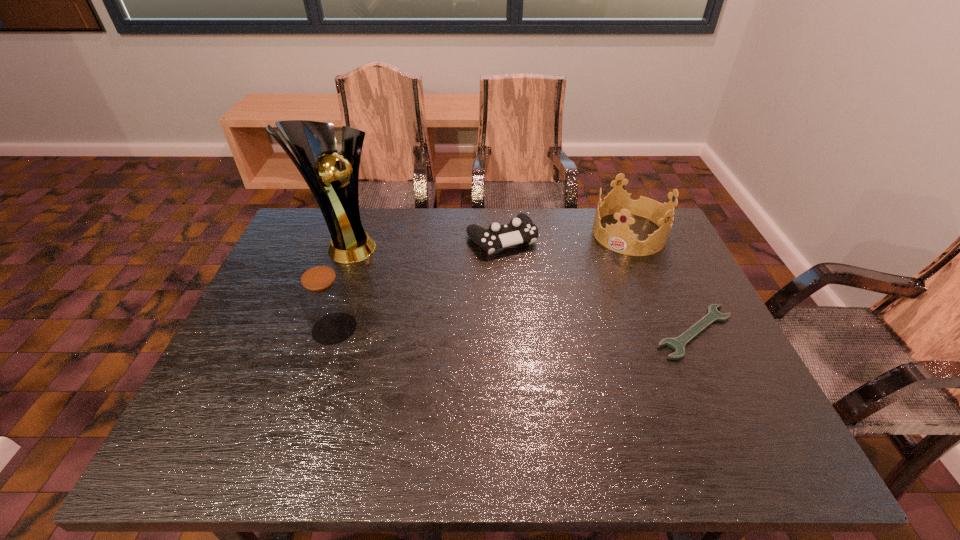
Locate an element on the screen. The height and width of the screenshot is (540, 960). jar is located at coordinates (324, 298).

Locate an element on the screen. the shortest object is located at coordinates (678, 343).

Where is `award`? Image resolution: width=960 pixels, height=540 pixels. award is located at coordinates (313, 143).

Locate an element on the screen. The height and width of the screenshot is (540, 960). tiara is located at coordinates (618, 237).

Identify the location of control. (521, 229).

Where is `the fourth tallest object`? the fourth tallest object is located at coordinates (521, 229).

Identify the location of free region located on the right of the jar. The width and height of the screenshot is (960, 540). (436, 329).

You are a GUI agent. You are given a task and a screenshot of the screen. Output one action in this format:
    pyautogui.click(x=<x>, y=<y>)
    Task: Click on the blank area located 0.180m on the left of the wrench
    The height and width of the screenshot is (540, 960).
    Given the screenshot: What is the action you would take?
    pyautogui.click(x=579, y=332)

Locate an element on the screen. This screenshot has height=540, width=960. free region located at the front of the award, where the globe is visible is located at coordinates (463, 320).

The width and height of the screenshot is (960, 540). I want to click on blank space located 0.300m at the front of the award, where the globe is visible, so click(440, 306).